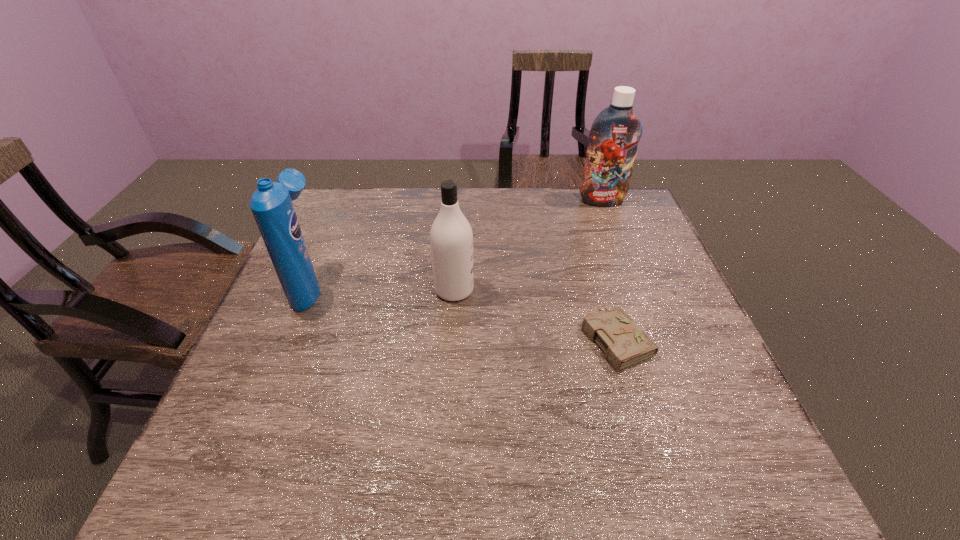
Locate an element on the screen. The height and width of the screenshot is (540, 960). free space that satisfies the following two spatial constraints: 1. on the back side of the diary; 2. on the front-facing side of the second shampoo from right to left is located at coordinates (602, 290).

Locate an element on the screen. This screenshot has height=540, width=960. free location that satisfies the following two spatial constraints: 1. on the front-facing side of the second shampoo from left to right; 2. on the left side of the shortest object is located at coordinates (451, 338).

This screenshot has width=960, height=540. I want to click on vacant point that satisfies the following two spatial constraints: 1. on the front-facing side of the shortest object; 2. on the right side of the second object from left to right, so click(x=451, y=338).